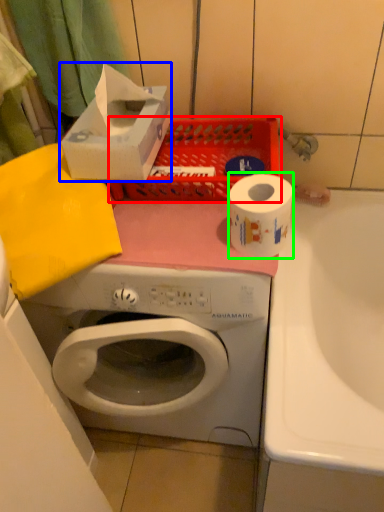
Question: Based on their relative distances, which object is farther from basket (highlighted by a red box)? Choose from storage box (highlighted by a blue box) and toilet paper (highlighted by a green box).

Choices:
 (A) storage box
 (B) toilet paper

Answer: (B)